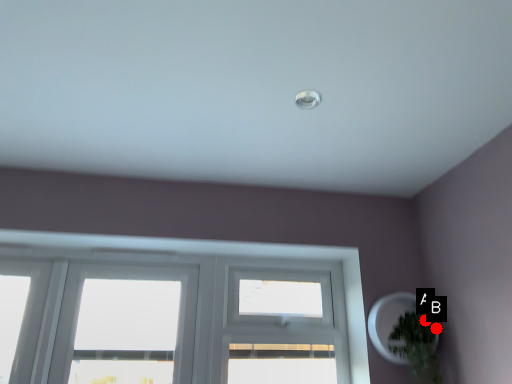
Question: Two points are circled on the image, labeled by A and B beside each circle. Which of the following is the closest to the observer?

Choices:
 (A) A is closer
 (B) B is closer

Answer: (A)